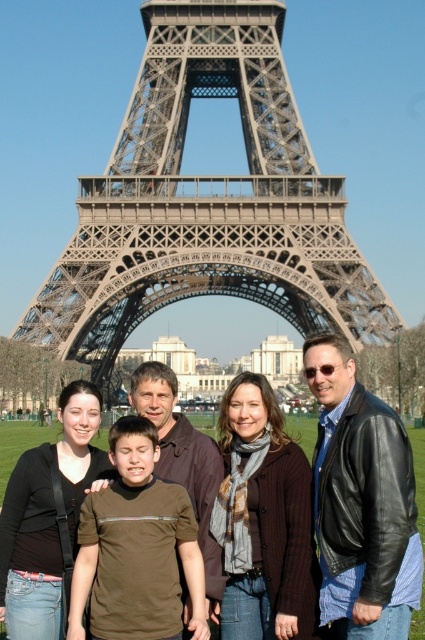
Between metallic gray eiffel tower at center and brown casual shirt at center, which one has less height?

brown casual shirt at center

This screenshot has height=640, width=425. In order to click on metallic gray eiffel tower at center in this screenshot , I will do `click(206, 202)`.

The image size is (425, 640). I want to click on metallic gray eiffel tower at center, so click(206, 202).